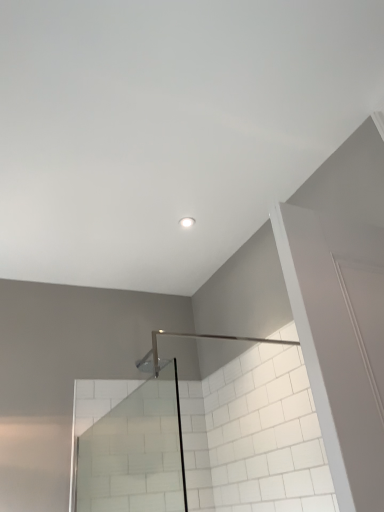
Question: Can you confirm if transparent glass shower door at center is shorter than white glossy light fixture at center?

Choices:
 (A) no
 (B) yes

Answer: (A)

Question: Considering the relative sizes of transparent glass shower door at center and white glossy light fixture at center in the image provided, is transparent glass shower door at center bigger than white glossy light fixture at center?

Choices:
 (A) yes
 (B) no

Answer: (A)

Question: From a real-world perspective, is transparent glass shower door at center on white glossy light fixture at center?

Choices:
 (A) no
 (B) yes

Answer: (A)

Question: Could you tell me if transparent glass shower door at center is facing white glossy light fixture at center?

Choices:
 (A) yes
 (B) no

Answer: (B)

Question: From a real-world perspective, is transparent glass shower door at center below white glossy light fixture at center?

Choices:
 (A) yes
 (B) no

Answer: (A)

Question: Does transparent glass shower door at center appear on the right side of white glossy light fixture at center?

Choices:
 (A) no
 (B) yes

Answer: (A)

Question: Is the depth of white glossy light fixture at center greater than that of transparent glass shower door at center?

Choices:
 (A) no
 (B) yes

Answer: (B)

Question: Is white glossy light fixture at center not within transparent glass shower door at center?

Choices:
 (A) no
 (B) yes

Answer: (B)

Question: Considering the relative sizes of white glossy light fixture at center and transparent glass shower door at center in the image provided, is white glossy light fixture at center thinner than transparent glass shower door at center?

Choices:
 (A) yes
 (B) no

Answer: (A)

Question: Does white glossy light fixture at center come in front of transparent glass shower door at center?

Choices:
 (A) no
 (B) yes

Answer: (A)

Question: Can you confirm if white glossy light fixture at center is shorter than transparent glass shower door at center?

Choices:
 (A) no
 (B) yes

Answer: (B)

Question: Is white glossy light fixture at center oriented towards transparent glass shower door at center?

Choices:
 (A) no
 (B) yes

Answer: (A)

Question: Relative to transparent glass shower door at center, is white glossy light fixture at center in front or behind?

Choices:
 (A) front
 (B) behind

Answer: (B)